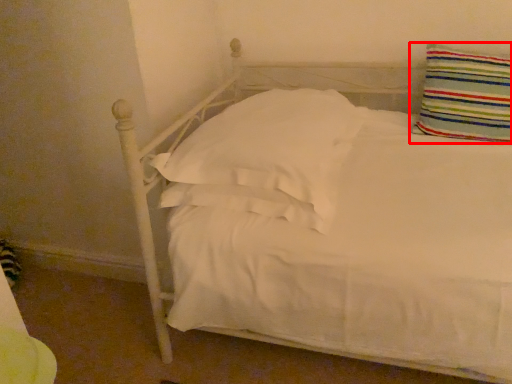
Question: Observing the image, what is the correct spatial positioning of pillow (annotated by the red box) in reference to pillow?

Choices:
 (A) left
 (B) right

Answer: (B)